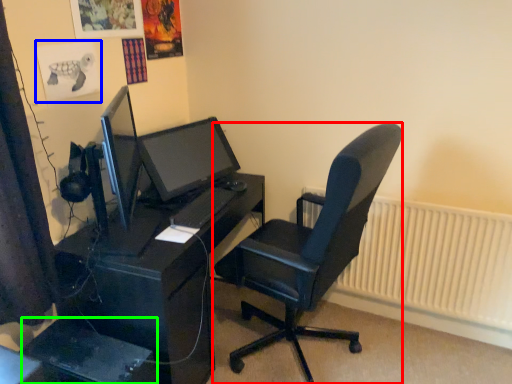
Question: Based on their relative distances, which object is nearer to chair (highlighted by a red box)? Choose from poster page (highlighted by a blue box) and computer tower (highlighted by a green box).

Choices:
 (A) poster page
 (B) computer tower

Answer: (B)